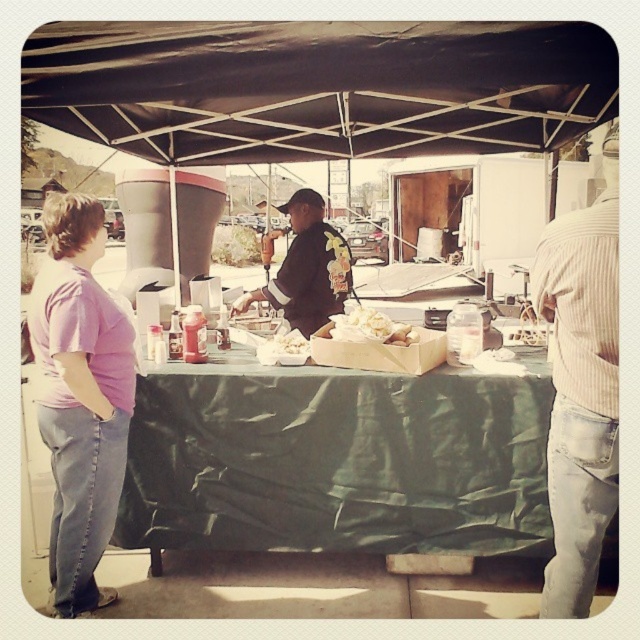
You are standing at the point with coordinates (317, 86) in the image. What object are you under?

The point at coordinates (317, 86) is under the black fabric canopy at center.

You are a customer at the outdoor food stall. You want to order food but need to approach the counter. Which object should you move towards first, the green fabric table at center or the purple cotton shirt at left?

You should move towards the green fabric table at center first because it is closer to you than the purple cotton shirt at left, which is further away.

What is the exact coordinate of the black fabric canopy at center?

The black fabric canopy at center is located at point (317, 86).